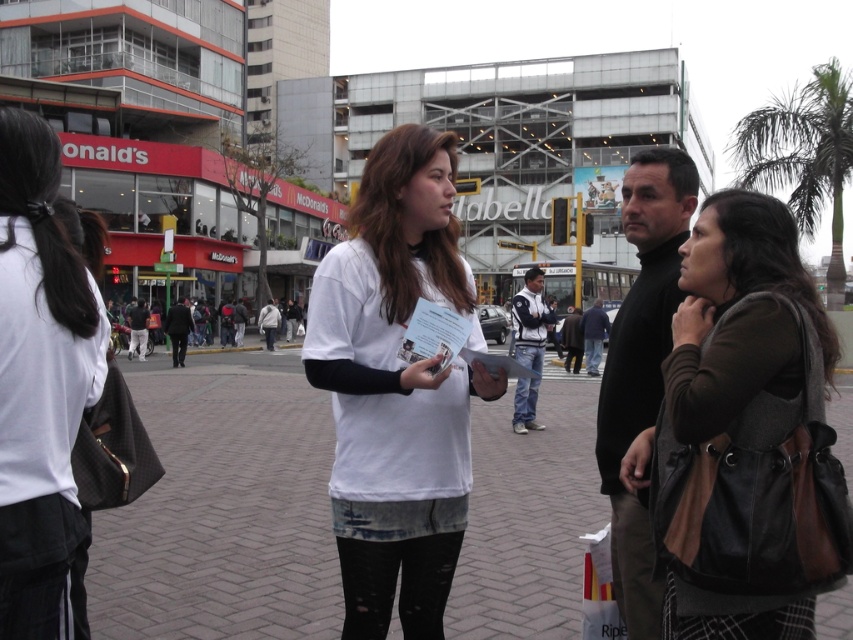
Question: From the image, what is the correct spatial relationship of brown leather bag at right in relation to black turtleneck sweater at center?

Choices:
 (A) above
 (B) below

Answer: (B)

Question: Which object is positioned closest to the dark blue jeans at center?

Choices:
 (A) black turtleneck sweater at center
 (B) white fabric shirt at upper left
 (C) white cotton jacket at center
 (D) white fleece jacket at center

Answer: (D)

Question: Which point is closer to the camera taking this photo?

Choices:
 (A) (61, 410)
 (B) (636, 280)
 (C) (276, 324)
 (D) (524, 410)

Answer: (A)

Question: Does white fabric shirt at upper left have a larger size compared to black turtleneck sweater at center?

Choices:
 (A) yes
 (B) no

Answer: (B)

Question: Which object is the farthest from the white cotton jacket at center?

Choices:
 (A) brown leather bag at right
 (B) white cotton shirt at center
 (C) brick pavement at center
 (D) white fleece jacket at center

Answer: (A)

Question: Can you confirm if brick pavement at center is wider than white fabric shirt at upper left?

Choices:
 (A) yes
 (B) no

Answer: (A)